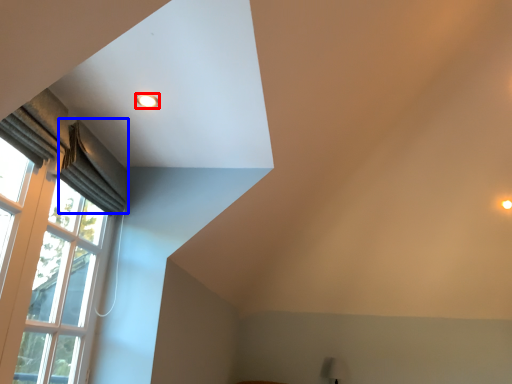
Question: Which object appears farthest to the camera in this image, lighting (highlighted by a red box) or curtain (highlighted by a blue box)?

Choices:
 (A) lighting
 (B) curtain

Answer: (B)